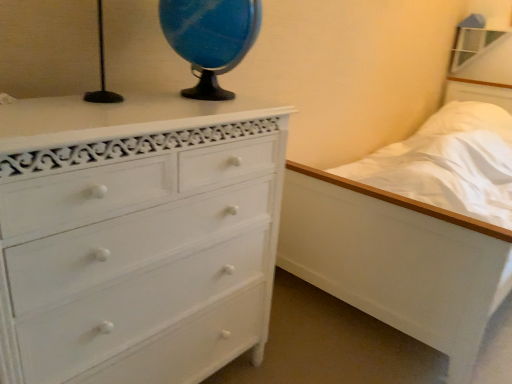
Find the location of `free space above white painted wood chest of drawers at left (from a real-world perspective)`. free space above white painted wood chest of drawers at left (from a real-world perspective) is located at coordinates (122, 104).